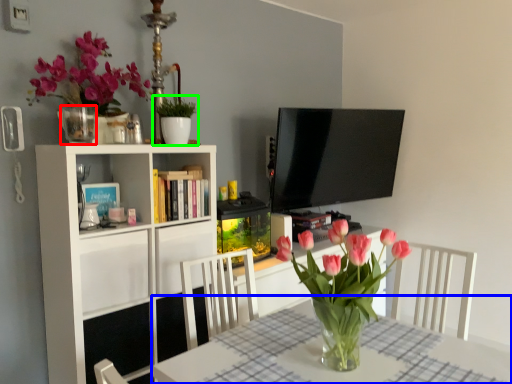
Question: Which object is positioned farthest from vase (highlighted by a red box)? Select from table (highlighted by a blue box) and houseplant (highlighted by a green box).

Choices:
 (A) table
 (B) houseplant

Answer: (A)